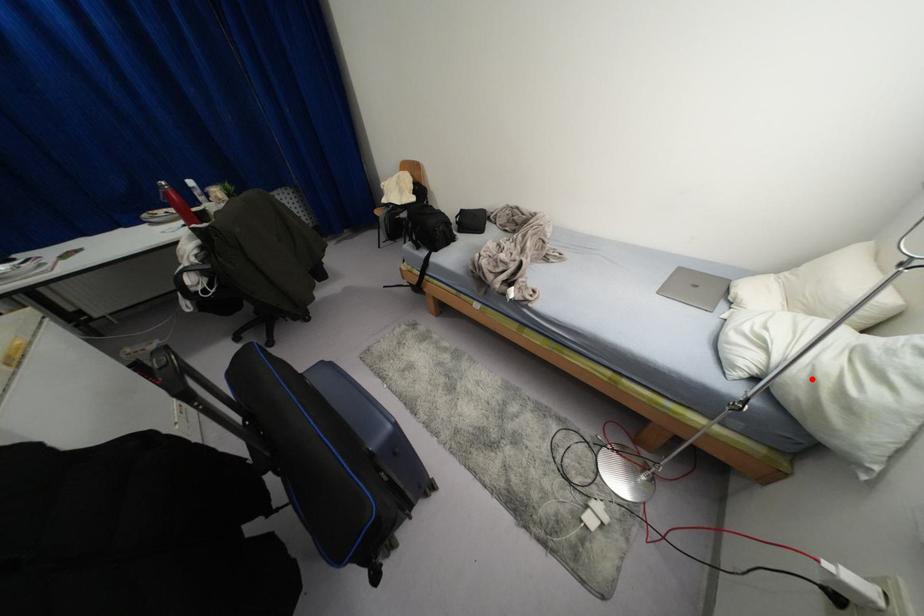
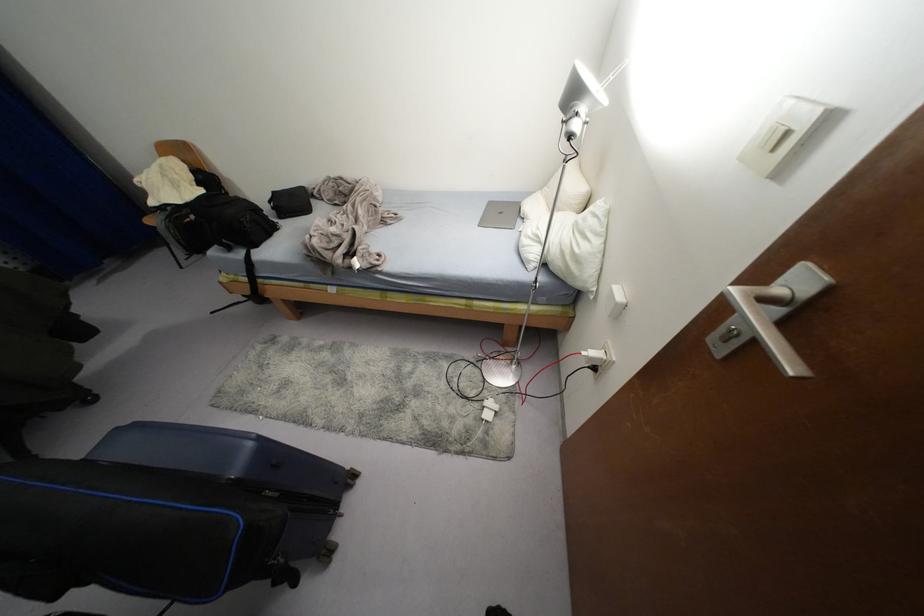
Question: I am providing you with two images of the same scene from different viewpoints. Image1 has a red point marked. In image2, the corresponding 3D location appears at what relative position? Reply with the corresponding letter.

Choices:
 (A) Closer
 (B) Farther

Answer: (A)